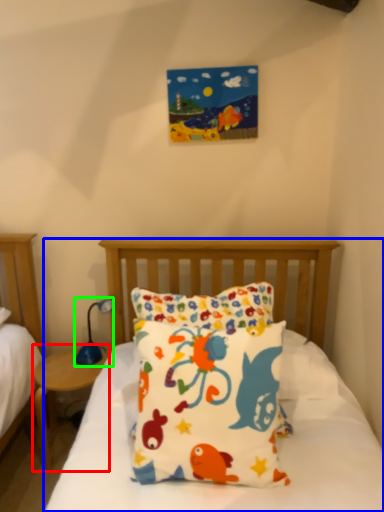
Question: Which object is positioned farthest from nightstand (highlighted by a red box)? Select from bed (highlighted by a blue box) and table lamp (highlighted by a green box).

Choices:
 (A) bed
 (B) table lamp

Answer: (A)